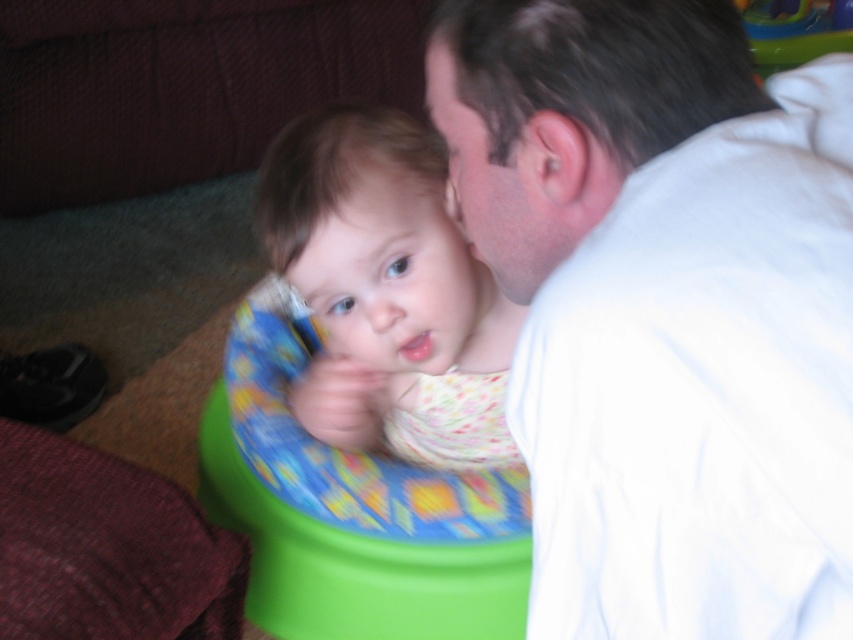
You are a photographer setting up a shoot in a living room. You need to position a stand with a light source between the white smooth shirt at upper right and the floral fabric baby at center. Since the stand is 1 meter wide, will it fit between them?

The white smooth shirt at upper right is thinner than the floral fabric baby at center, so the distance between them is wider than the shirt. However, the exact distance isn not provided. Without knowing the actual space between them, we can not confirm if the 1 meter wide stand will fit.

You are a photographer setting up for a family portrait. You need to position the white smooth shirt at upper right and the floral fabric baby at center so that the adult and child are facing each other. Based on their current positions, which object is on the right side of the other?

The white smooth shirt at upper right is positioned on the right side of floral fabric baby at center, so the adult in the white smooth shirt at upper right is on the right side of the floral fabric baby at center.